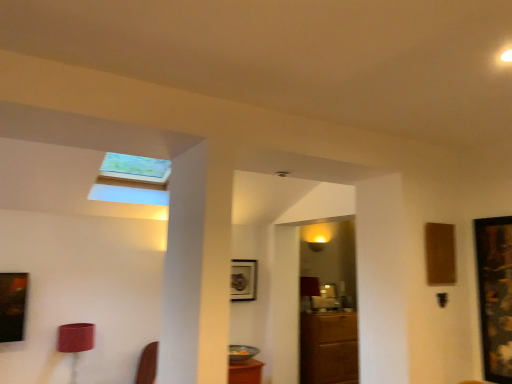
Question: Is metallic silver picture frame at center, placed as the second picture frame when sorted from front to back, inside wooden framed artwork at right, acting as the 1th picture frame starting from the right?

Choices:
 (A) yes
 (B) no

Answer: (B)

Question: Is wooden framed artwork at right, acting as the 1th picture frame starting from the right, thinner than metallic silver picture frame at center, placed as the second picture frame when sorted from front to back?

Choices:
 (A) no
 (B) yes

Answer: (B)

Question: Does wooden framed artwork at right, acting as the 1th picture frame starting from the right, lie behind metallic silver picture frame at center, acting as the first picture frame starting from the left?

Choices:
 (A) no
 (B) yes

Answer: (A)

Question: Does wooden framed artwork at right, the 2th picture frame positioned from the left, come in front of metallic silver picture frame at center, which is counted as the 1th picture frame, starting from the back?

Choices:
 (A) no
 (B) yes

Answer: (B)

Question: From the image's perspective, is wooden framed artwork at right, the 2th picture frame positioned from the left, located beneath metallic silver picture frame at center, acting as the first picture frame starting from the left?

Choices:
 (A) no
 (B) yes

Answer: (A)

Question: Does wooden framed artwork at right, the 2th picture frame positioned from the left, appear on the left side of metallic silver picture frame at center, which is counted as the 1th picture frame, starting from the back?

Choices:
 (A) yes
 (B) no

Answer: (B)

Question: Considering the relative sizes of brown wooden cabinet at center and metallic silver picture frame at center, which is counted as the 1th picture frame, starting from the back, in the image provided, is brown wooden cabinet at center thinner than metallic silver picture frame at center, which is counted as the 1th picture frame, starting from the back,?

Choices:
 (A) yes
 (B) no

Answer: (B)

Question: Considering the relative sizes of brown wooden cabinet at center and metallic silver picture frame at center, which is counted as the 1th picture frame, starting from the back, in the image provided, is brown wooden cabinet at center wider than metallic silver picture frame at center, which is counted as the 1th picture frame, starting from the back,?

Choices:
 (A) yes
 (B) no

Answer: (A)

Question: Is brown wooden cabinet at center positioned beyond the bounds of metallic silver picture frame at center, marked as the 2th picture frame in a right-to-left arrangement?

Choices:
 (A) yes
 (B) no

Answer: (A)

Question: Does brown wooden cabinet at center have a smaller size compared to metallic silver picture frame at center, marked as the 2th picture frame in a right-to-left arrangement?

Choices:
 (A) yes
 (B) no

Answer: (B)

Question: Is brown wooden cabinet at center at the left side of metallic silver picture frame at center, placed as the second picture frame when sorted from front to back?

Choices:
 (A) yes
 (B) no

Answer: (B)

Question: Can you confirm if brown wooden cabinet at center is bigger than metallic silver picture frame at center, placed as the second picture frame when sorted from front to back?

Choices:
 (A) yes
 (B) no

Answer: (A)

Question: Considering the relative positions of brown wooden cabinet at center and wooden framed artwork at right, the 2th picture frame positioned from the left, in the image provided, is brown wooden cabinet at center to the right of wooden framed artwork at right, the 2th picture frame positioned from the left, from the viewer's perspective?

Choices:
 (A) no
 (B) yes

Answer: (A)